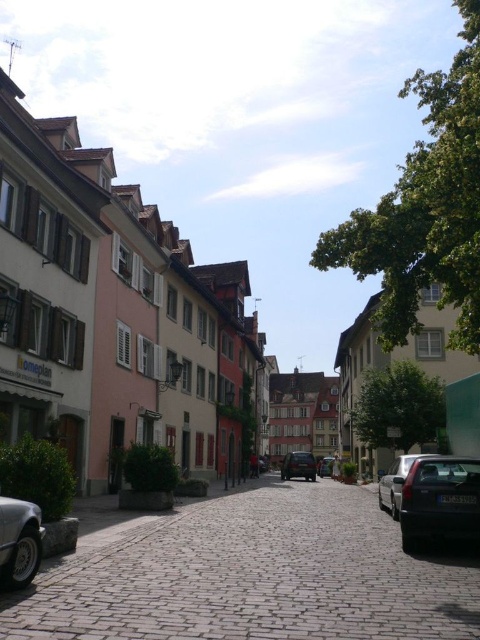
Question: Which point is farther to the camera?

Choices:
 (A) brown cobblestone alley at center
 (B) metallic silver car at center
 (C) satin silver sedan at center
 (D) silver metallic car at lower left

Answer: (B)

Question: Does matte stone street at center have a lesser width compared to brown cobblestone alley at center?

Choices:
 (A) yes
 (B) no

Answer: (B)

Question: Estimate the real-world distances between objects in this image. Which object is closer to the silver metallic car at lower left?

Choices:
 (A) satin silver sedan at center
 (B) shiny black car at center
 (C) matte black car at lower right
 (D) brown cobblestone alley at center

Answer: (D)

Question: Which of the following is the closest to the observer?

Choices:
 (A) (312, 461)
 (B) (324, 476)
 (C) (40, 529)
 (D) (470, 515)

Answer: (C)

Question: Is brown cobblestone alley at center further to the viewer compared to silver metallic car at lower left?

Choices:
 (A) no
 (B) yes

Answer: (A)

Question: Is silver metallic car at lower left positioned before satin silver sedan at center?

Choices:
 (A) no
 (B) yes

Answer: (B)